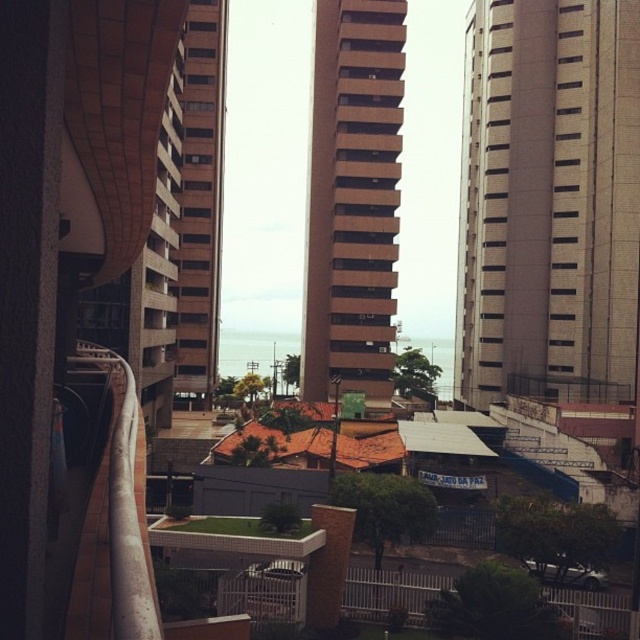
Does gray concrete building at center lie behind white painted metal railing at left?

Yes, gray concrete building at center is further from the viewer.

Can you confirm if gray concrete building at center is thinner than white painted metal railing at left?

Incorrect, gray concrete building at center's width is not less than white painted metal railing at left's.

The width and height of the screenshot is (640, 640). What do you see at coordinates (548, 202) in the screenshot? I see `gray concrete building at center` at bounding box center [548, 202].

Where is `gray concrete building at center`? This screenshot has height=640, width=640. gray concrete building at center is located at coordinates (548, 202).

Is gray concrete building at center to the left of white metal fence at lower center from the viewer's perspective?

No, gray concrete building at center is not to the left of white metal fence at lower center.

Who is more distant from viewer, (602, 168) or (564, 612)?

The point (602, 168) is behind.

At what (x,y) coordinates should I click in order to perform the action: click on gray concrete building at center. Please return your answer as a coordinate pair (x, y). Looking at the image, I should click on (548, 202).

In the scene shown: Which of these two, brown concrete building at center or white painted metal railing at left, stands taller?

brown concrete building at center

Is brown concrete building at center above white painted metal railing at left?

Yes, brown concrete building at center is above white painted metal railing at left.

You are a GUI agent. You are given a task and a screenshot of the screen. Output one action in this format:
    pyautogui.click(x=<x>, y=<y>)
    Task: Click on the brown concrete building at center
    The image size is (640, 640).
    Given the screenshot: What is the action you would take?
    pyautogui.click(x=353, y=198)